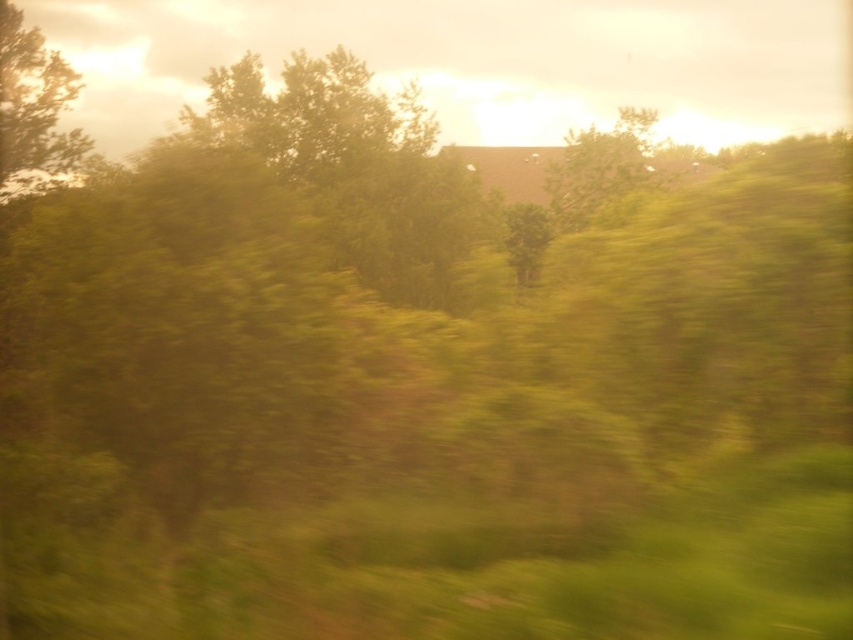
Question: Does green leafy tree at upper left have a larger size compared to green leafy tree at center?

Choices:
 (A) yes
 (B) no

Answer: (B)

Question: Is green leafy tree at upper left further to the viewer compared to green leafy tree at center?

Choices:
 (A) yes
 (B) no

Answer: (B)

Question: Which point is closer to the camera?

Choices:
 (A) (33, 172)
 (B) (622, 131)

Answer: (A)

Question: Does green leafy tree at upper left appear on the right side of green leafy tree at center?

Choices:
 (A) yes
 (B) no

Answer: (B)